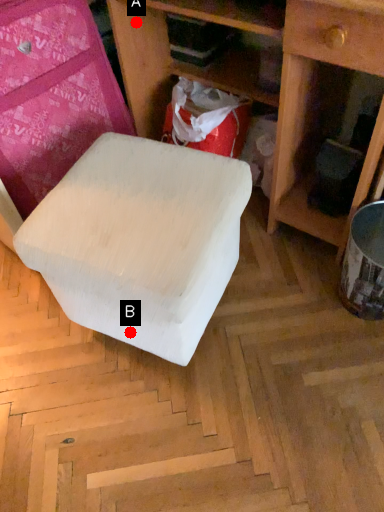
Question: Two points are circled on the image, labeled by A and B beside each circle. Which point is farther to the camera?

Choices:
 (A) A is further
 (B) B is further

Answer: (A)